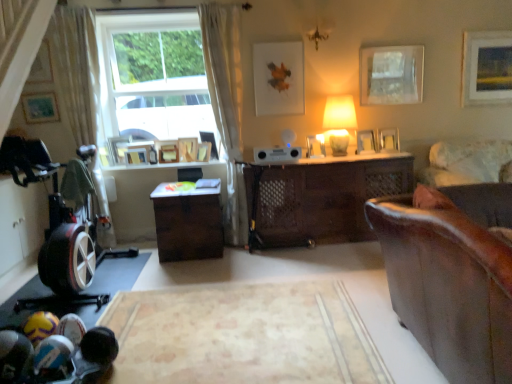
Question: Based on their sizes in the image, would you say matte wooden picture frame at upper left, which ranks as the 2th picture frame in left-to-right order, is bigger or smaller than wooden picture frame at upper left, positioned as the 4th picture frame in left-to-right order?

Choices:
 (A) big
 (B) small

Answer: (A)

Question: Relative to wooden picture frame at upper left, positioned as the 4th picture frame in left-to-right order, is matte wooden picture frame at upper left, which ranks as the 2th picture frame in left-to-right order, in front or behind?

Choices:
 (A) front
 (B) behind

Answer: (A)

Question: Estimate the real-world distances between objects in this image. Which object is closer to the matte white picture frame at upper left, which is the 1th picture frame in left-to-right order?

Choices:
 (A) wooden picture frame at upper center, the sixth picture frame positioned from the left
 (B) wooden picture frame at center, placed as the third picture frame when sorted from right to left
 (C) wooden picture frame at center, acting as the fifth picture frame starting from the right
 (D) matte white lampshade at center-right
 (E) wooden picture frame at center, the fourth picture frame viewed from the right

Answer: (A)

Question: Estimate the real-world distances between objects in this image. Which object is farther from the wooden picture frame at center, acting as the fifth picture frame starting from the right?

Choices:
 (A) wooden picture frame at center, the fourth picture frame viewed from the right
 (B) matte white picture frame at upper left, which is the 1th picture frame in left-to-right order
 (C) wooden picture frame at upper right, which appears as the first picture frame when viewed from the right
 (D) matte white picture frame at upper center, the 6th picture frame viewed from the right
 (E) brown matte desk at center, the 1th desk positioned from the left

Answer: (B)